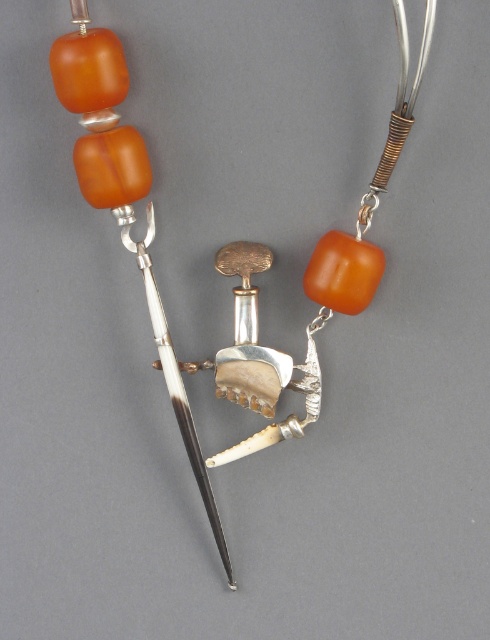
Question: Is matte orange glass beads at upper center wider than matte orange bead at upper left?

Choices:
 (A) no
 (B) yes

Answer: (B)

Question: Which point appears farthest from the camera in this image?

Choices:
 (A) (84, 0)
 (B) (143, 257)

Answer: (B)

Question: Can you confirm if matte orange glass beads at upper center is smaller than matte orange bead at upper left?

Choices:
 (A) no
 (B) yes

Answer: (A)

Question: Which object appears closest to the camera in this image?

Choices:
 (A) matte orange glass beads at upper center
 (B) matte orange bead at upper left

Answer: (A)

Question: Is matte orange glass beads at upper center below matte orange bead at upper left?

Choices:
 (A) no
 (B) yes

Answer: (A)